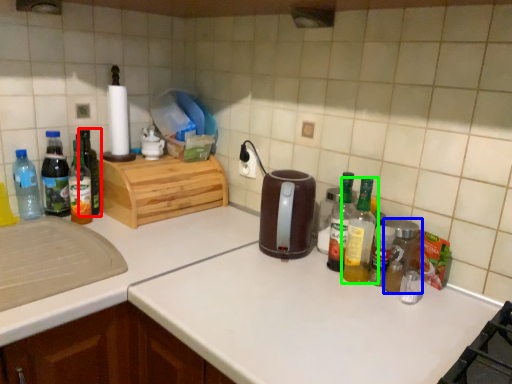
Question: Which is nearer to the bottle (highlighted by a red box)? bottle (highlighted by a blue box) or bottle (highlighted by a green box).

Choices:
 (A) bottle
 (B) bottle

Answer: (B)